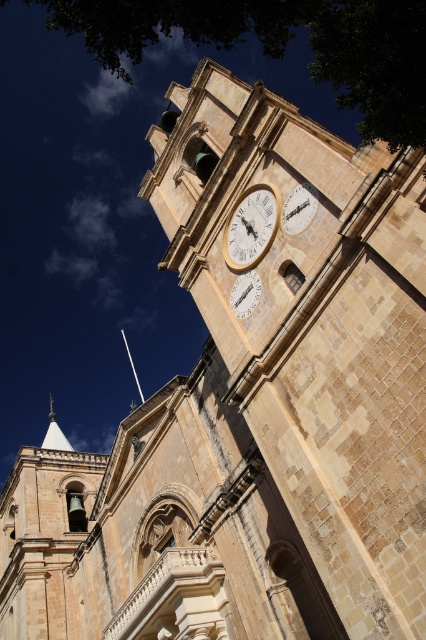
Question: Which object is farther from the camera taking this photo?

Choices:
 (A) matte white clock at center
 (B) white glossy clock at center

Answer: (B)

Question: Which point is closer to the camera?

Choices:
 (A) silver metallic spire at upper left
 (B) matte white clock at center

Answer: (B)

Question: Does white matte clock at upper center appear on the left side of silver metallic spire at upper left?

Choices:
 (A) no
 (B) yes

Answer: (A)

Question: Which object is farther from the camera taking this photo?

Choices:
 (A) white glossy clock at center
 (B) matte white clock at center

Answer: (A)

Question: Can you confirm if matte white clock at center is positioned to the right of silver metallic spire at upper left?

Choices:
 (A) yes
 (B) no

Answer: (A)

Question: Observing the image, what is the correct spatial positioning of matte white clock at center in reference to white stone spire at upper left?

Choices:
 (A) right
 (B) left

Answer: (A)